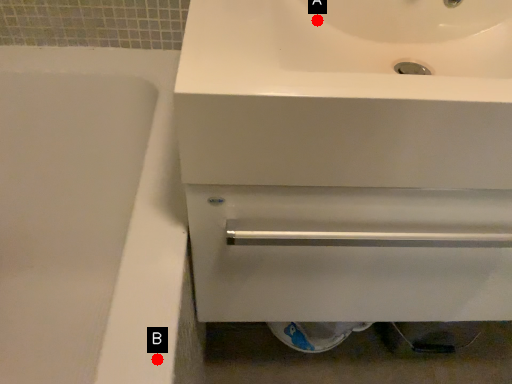
Question: Two points are circled on the image, labeled by A and B beside each circle. Which of the following is the closest to the observer?

Choices:
 (A) A is closer
 (B) B is closer

Answer: (B)